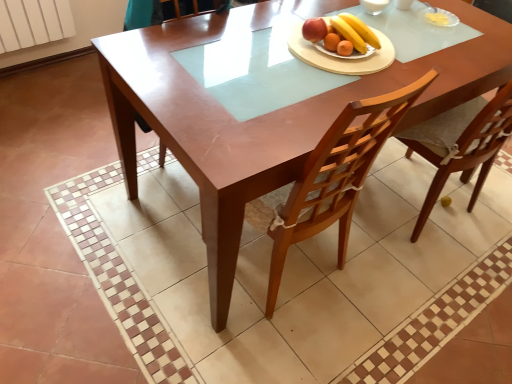
Where is `empty space that is to the right of shiny white plate with fruits at center`? empty space that is to the right of shiny white plate with fruits at center is located at coordinates (397, 48).